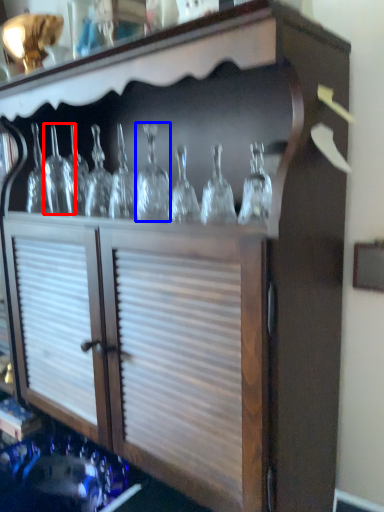
Question: Which point is further to the camera, glass bottle (highlighted by a red box) or glass bottle (highlighted by a blue box)?

Choices:
 (A) glass bottle
 (B) glass bottle

Answer: (A)